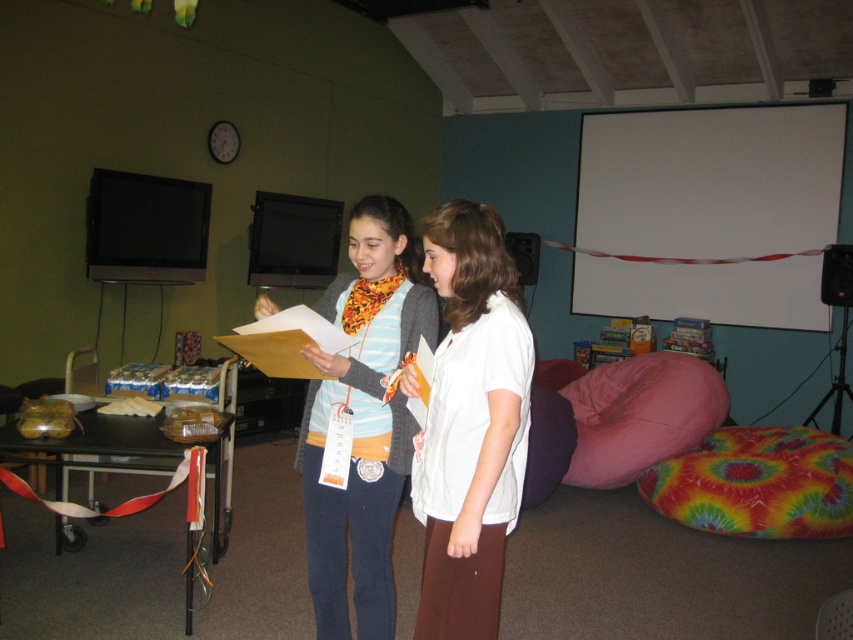
Who is more distant from viewer, (825, 221) or (364, 196)?

The point (825, 221) is more distant.

From the picture: Who is positioned more to the left, white matte projection screen at upper center or striped cotton shirt at center?

Positioned to the left is striped cotton shirt at center.

Is point (735, 243) less distant than point (373, 410)?

No, (735, 243) is further to viewer.

This screenshot has height=640, width=853. I want to click on white matte projection screen at upper center, so click(x=711, y=179).

Who is more distant from viewer, (415, 280) or (653, 392)?

Positioned behind is point (653, 392).

Looking at this image, which is more to the left, striped cotton shirt at center or pink fabric bean bag at lower right?

striped cotton shirt at center is more to the left.

Which is behind, point (317, 550) or point (569, 369)?

Positioned behind is point (569, 369).

Where is `striped cotton shirt at center`? striped cotton shirt at center is located at coordinates (363, 419).

Who is taller, white cotton shirt at center or pink fabric bean bag at lower right?

With more height is white cotton shirt at center.

Does white cotton shirt at center have a lesser height compared to pink fabric bean bag at lower right?

No, white cotton shirt at center is not shorter than pink fabric bean bag at lower right.

Consider the image. Who is more distant from viewer, (456, 244) or (608, 436)?

Positioned behind is point (608, 436).

Find the location of a particular element. The width and height of the screenshot is (853, 640). white cotton shirt at center is located at coordinates (469, 424).